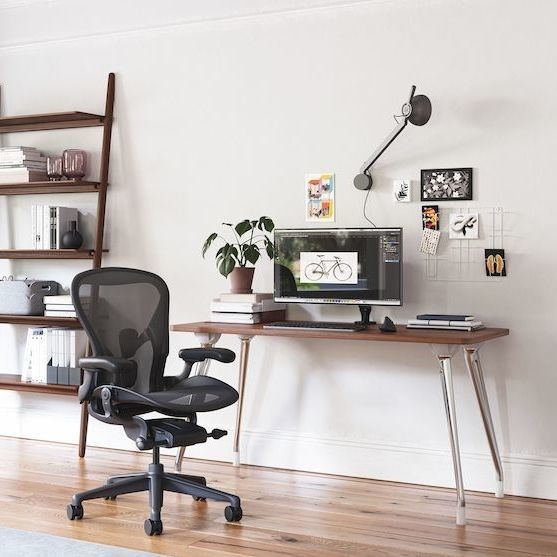
You are a GUI agent. You are given a task and a screenshot of the screen. Output one action in this format:
    pyautogui.click(x=<x>, y=<y>)
    Task: Click on the plant vase
    This screenshot has width=557, height=557.
    Given the screenshot: What is the action you would take?
    pyautogui.click(x=238, y=275)